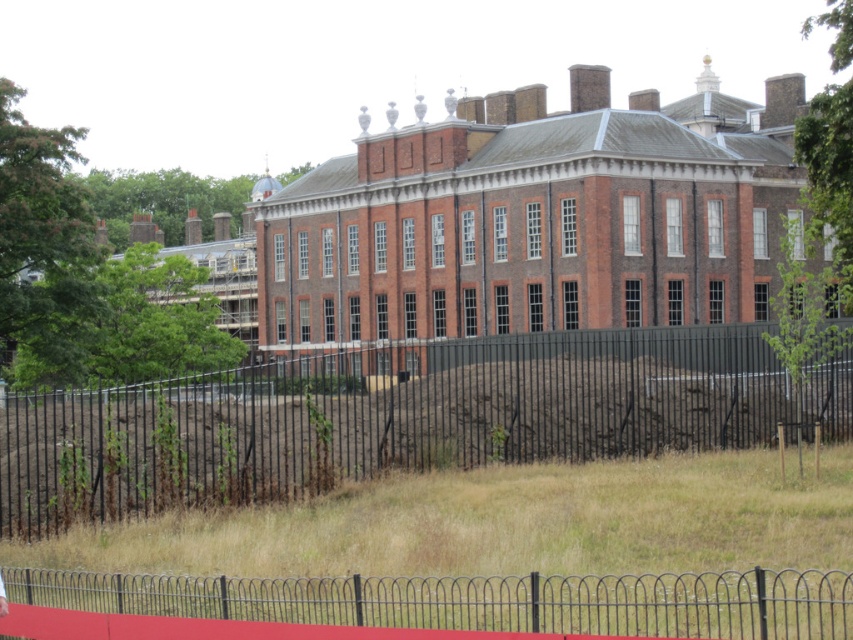
Question: Is the position of black metal fence at center more distant than that of metallic wire fence at lower center?

Choices:
 (A) yes
 (B) no

Answer: (A)

Question: Observing the image, what is the correct spatial positioning of black metal fence at center in reference to metallic wire fence at lower center?

Choices:
 (A) above
 (B) below

Answer: (A)

Question: Which object is closer to the camera taking this photo?

Choices:
 (A) black metal fence at center
 (B) metallic wire fence at lower center

Answer: (B)

Question: Does black metal fence at center have a larger size compared to metallic wire fence at lower center?

Choices:
 (A) yes
 (B) no

Answer: (A)